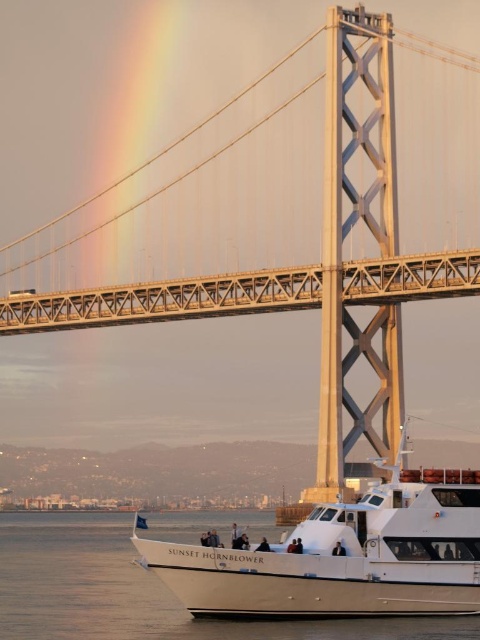
You are an observer standing on the suspension bridge and see the white matte boat at lower right and the white smooth water at lower center. Which object is located to the right of the other?

The white matte boat at lower right is positioned on the right side of white smooth water at lower center.

You are a photographer planning to capture the sunset on the Bay Bridge. You notice the white matte boat at lower right and the white smooth water at lower center in your shot. Which object appears narrower in your photo?

The white matte boat at lower right appears narrower than the white smooth water at lower center in the photo.